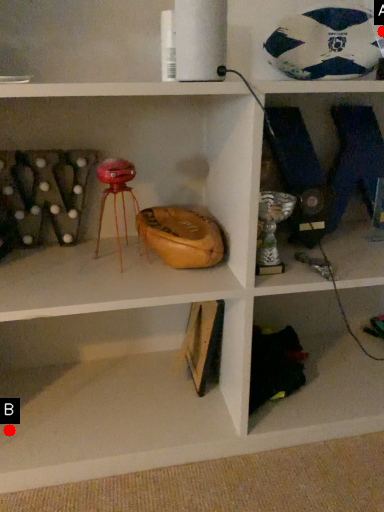
Question: Two points are circled on the image, labeled by A and B beside each circle. Which of the following is the closest to the observer?

Choices:
 (A) A is closer
 (B) B is closer

Answer: (A)